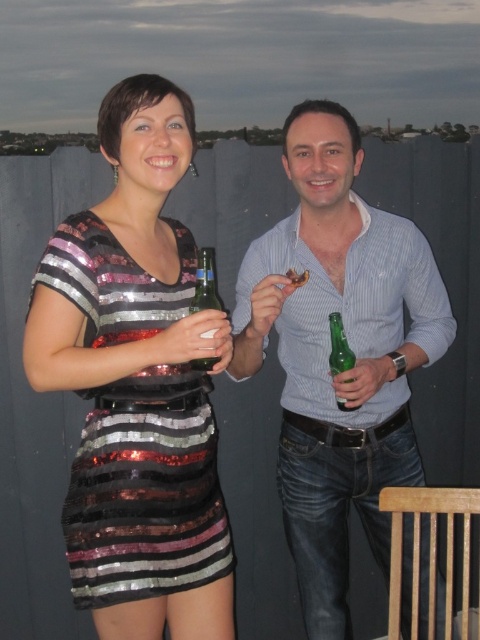
Question: Which point is closer to the camera?

Choices:
 (A) (271, 301)
 (B) (339, 330)
 (C) (203, 275)
 (D) (85, 576)

Answer: (C)

Question: Does shiny sequined dress at left have a lesser width compared to green glass beer bottle at center?

Choices:
 (A) no
 (B) yes

Answer: (A)

Question: Which of these objects is positioned closest to the blue striped shirt at center?

Choices:
 (A) green glass bottle at right
 (B) shiny sequined dress at left
 (C) green glass beer bottle at center

Answer: (A)

Question: Can you confirm if green glass beer bottle at center is positioned above green glass bottle at right?

Choices:
 (A) yes
 (B) no

Answer: (A)

Question: Which of the following is the farthest from the observer?

Choices:
 (A) [x=214, y=291]
 (B) [x=359, y=296]
 (C) [x=336, y=317]

Answer: (B)

Question: Where is blue striped shirt at center located in relation to shiny sequined dress at left in the image?

Choices:
 (A) left
 (B) right

Answer: (B)